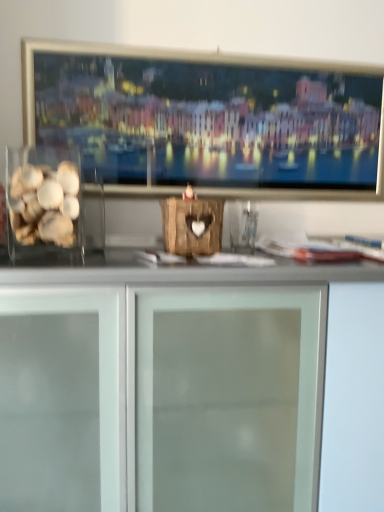
Question: Is translucent glass shells at left taller or shorter than frosted glass cabinet at center?

Choices:
 (A) tall
 (B) short

Answer: (B)

Question: Considering the relative positions of translucent glass shells at left and frosted glass cabinet at center in the image provided, is translucent glass shells at left to the left or to the right of frosted glass cabinet at center?

Choices:
 (A) left
 (B) right

Answer: (A)

Question: Do you think translucent glass shells at left is within frosted glass cabinet at center, or outside of it?

Choices:
 (A) outside
 (B) inside

Answer: (A)

Question: Do you think frosted glass cabinet at center is within translucent glass shells at left, or outside of it?

Choices:
 (A) outside
 (B) inside

Answer: (A)

Question: In terms of height, does frosted glass cabinet at center look taller or shorter compared to translucent glass shells at left?

Choices:
 (A) tall
 (B) short

Answer: (A)

Question: In the image, is frosted glass cabinet at center positioned in front of or behind translucent glass shells at left?

Choices:
 (A) front
 (B) behind

Answer: (A)

Question: From a real-world perspective, is frosted glass cabinet at center physically located above or below translucent glass shells at left?

Choices:
 (A) above
 (B) below

Answer: (B)